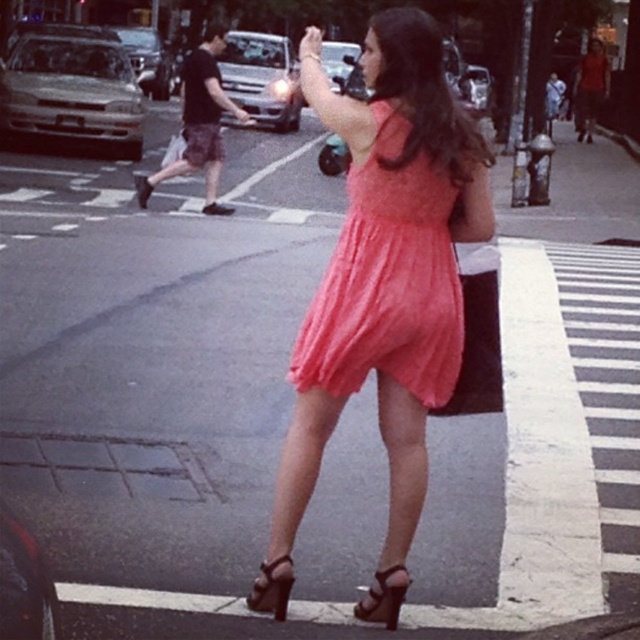
Can you confirm if shiny brown sandal at lower center is positioned above brown leather sandal at lower center?

Actually, shiny brown sandal at lower center is below brown leather sandal at lower center.

Who is positioned more to the right, shiny brown sandal at lower center or brown leather sandal at lower center?

shiny brown sandal at lower center

Is point (394, 577) closer to camera compared to point (291, 561)?

Yes.

This screenshot has height=640, width=640. I want to click on shiny brown sandal at lower center, so click(384, 596).

Which is in front, point (376, 99) or point (381, 269)?

Positioned in front is point (381, 269).

Measure the distance from coral fabric dress at center to coral chiffon dress at center.

coral fabric dress at center is 3.13 inches from coral chiffon dress at center.

Is point (314, 472) farther from viewer compared to point (397, 115)?

Yes, it is behind point (397, 115).

The width and height of the screenshot is (640, 640). Find the location of `coral fabric dress at center`. coral fabric dress at center is located at coordinates (387, 268).

Is the position of coral fabric dress at center more distant than that of shiny brown sandal at lower center?

No, it is not.

Who is lower down, coral fabric dress at center or shiny brown sandal at lower center?

shiny brown sandal at lower center

In order to click on coral fabric dress at center in this screenshot , I will do `click(387, 268)`.

Identify the location of coral fabric dress at center. The width and height of the screenshot is (640, 640). (387, 268).